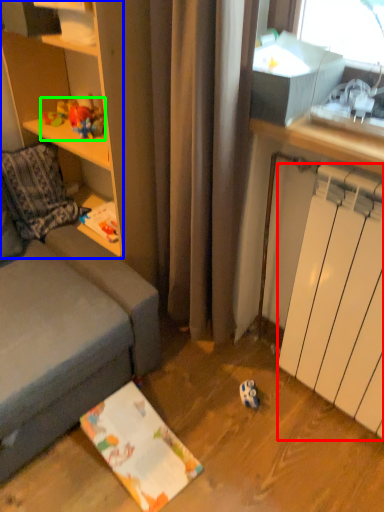
Question: Which object is positioned farthest from radiator (highlighted by a red box)? Select from cabinetry (highlighted by a blue box) and toy (highlighted by a green box).

Choices:
 (A) cabinetry
 (B) toy

Answer: (B)